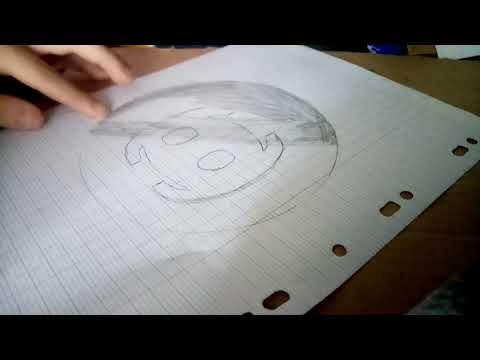
Locate an element on the screen. This screenshot has height=360, width=480. desktop is located at coordinates (429, 70).